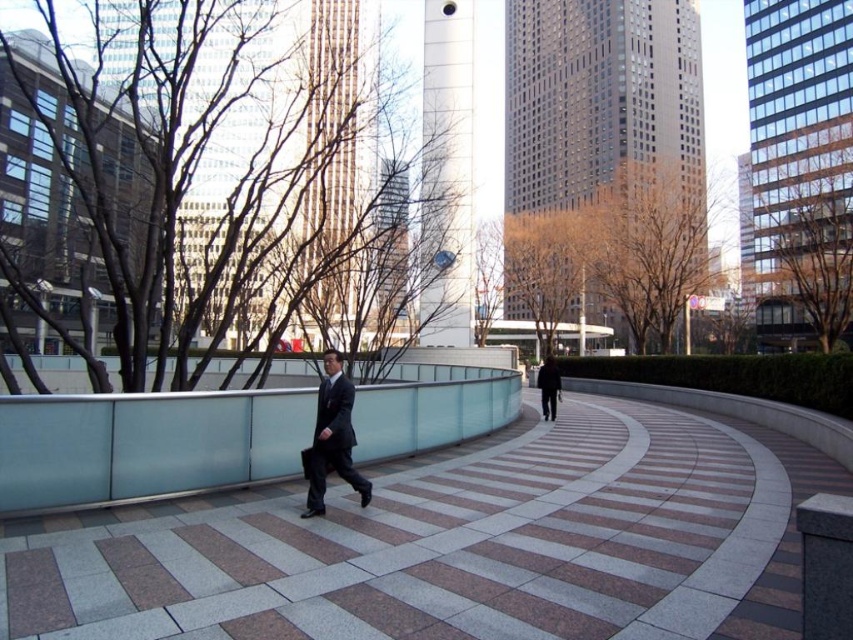
You are standing at the point labeled as point (456, 545) in the image. What surface are you currently standing on?

You are standing on the granite walkway at center, as the point (456, 545) corresponds to that location.

In the scene shown: You are standing at the entrance of the walkway and want to meet the person in the dark gray suit at center. Based on their current position, in which direction should you move to intercept them?

The dark gray suit at center is located at coordinates point (332, 436). To intercept them, you should move towards the left side of the frame since they are heading towards the left side of the frame.